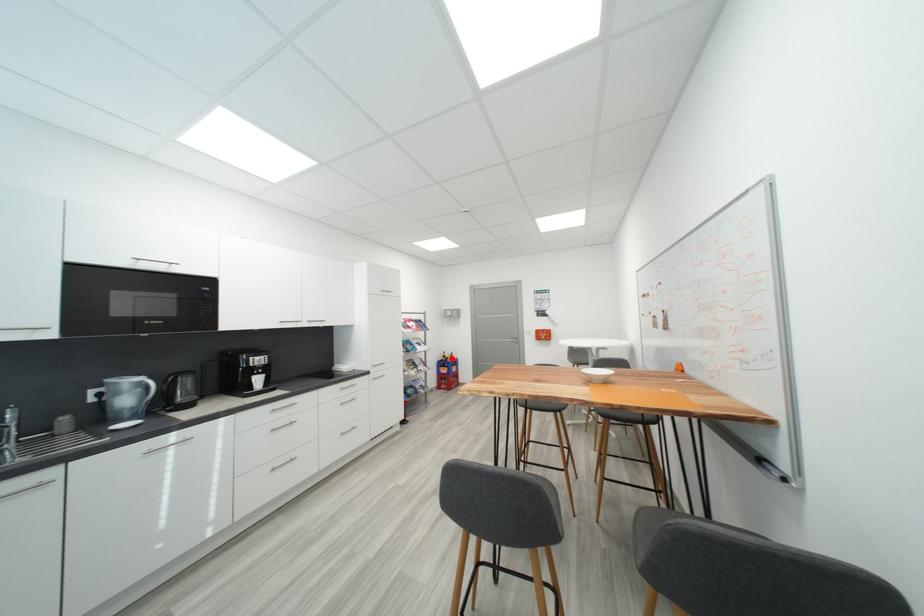
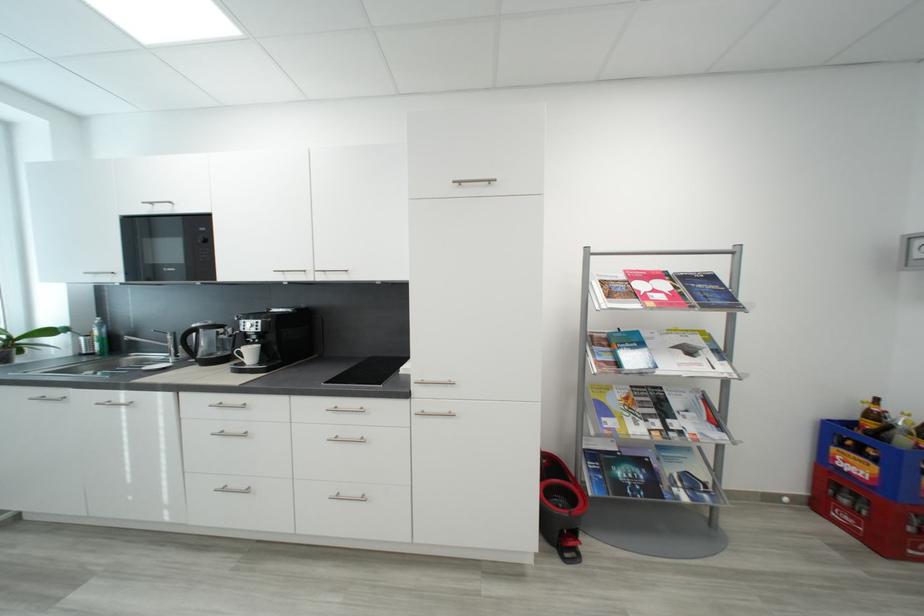
Question: I am providing you with two images of the same scene from different viewpoints. A red point is shown in image1. For the corresponding object point in image2, is it positioned nearer or farther from the camera?

Choices:
 (A) Nearer
 (B) Farther

Answer: (A)